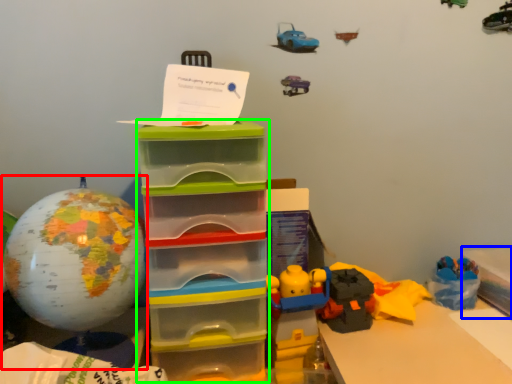
Question: Which is farther away from toy (highlighted by a red box)? storage box (highlighted by a blue box) or storage box (highlighted by a green box)?

Choices:
 (A) storage box
 (B) storage box

Answer: (A)